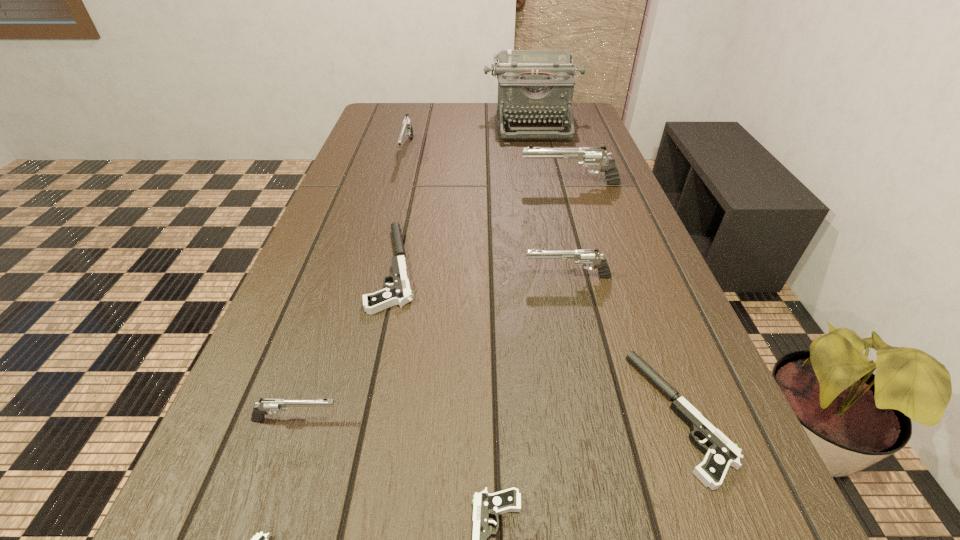
At what (x,y) coordinates should I click in order to perform the action: click on the third black pistol from right to left. Please return your answer as a coordinate pair (x, y). Looking at the image, I should click on (399, 293).

Find the location of a particular element. This screenshot has height=540, width=960. the fourth shortest pistol is located at coordinates (399, 293).

At what (x,y) coordinates should I click in order to perform the action: click on the sixth tallest pistol. Please return your answer as a coordinate pair (x, y). The width and height of the screenshot is (960, 540). Looking at the image, I should click on (722, 452).

At what (x,y) coordinates should I click in order to perform the action: click on the rightmost black pistol. Please return your answer as a coordinate pair (x, y). The image size is (960, 540). Looking at the image, I should click on (722, 452).

Where is `vacant space located on the typing side of the gray typewriter`? Image resolution: width=960 pixels, height=540 pixels. vacant space located on the typing side of the gray typewriter is located at coordinates (548, 194).

Identify the location of free space located 0.260m on the front-facing side of the tallest pistol. (425, 184).

The height and width of the screenshot is (540, 960). Identify the location of free space located 0.080m on the front-facing side of the tallest pistol. (492, 184).

The height and width of the screenshot is (540, 960). Find the location of `vacant space located on the front-facing side of the tallest pistol`. vacant space located on the front-facing side of the tallest pistol is located at coordinates pyautogui.click(x=388, y=184).

At what (x,y) coordinates should I click in order to perform the action: click on vacant space located 0.250m on the front-facing side of the seventh shortest pistol. Please return your answer as a coordinate pair (x, y). Looking at the image, I should click on (390, 220).

This screenshot has height=540, width=960. I want to click on vacant region located on the front-facing side of the third farthest silver pistol, so click(x=366, y=277).